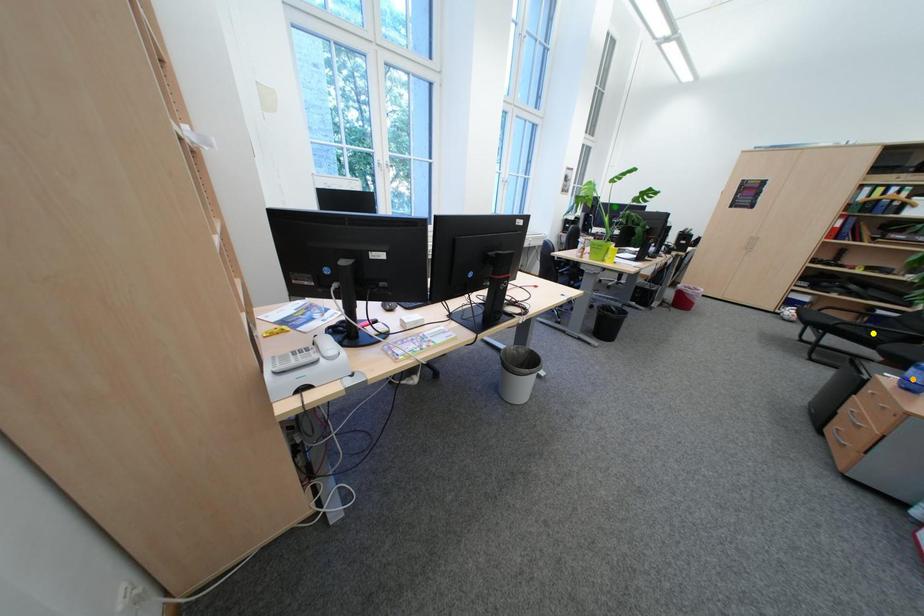
Order these from nearest to farthest:
A) orange point
B) green point
C) yellow point

orange point
yellow point
green point